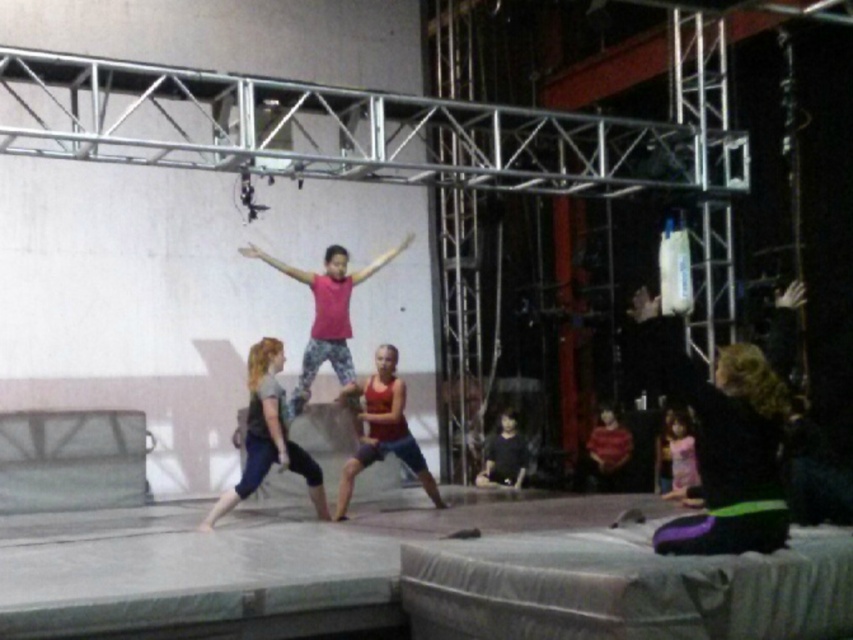
You are organizing a fashion show and need to display two dresses in the gymnasium. The black fabric dress at lower right and the pink fabric dress at lower right are both placed at the lower right corner. Which dress will be more visible to the audience seated in front of the gymnasium?

The black fabric dress at lower right is positioned over the pink fabric dress at lower right, so the black fabric dress at lower right will be more visible to the audience since it is in front.

You are a photographer setting up for a photoshoot in this gym. You have two outfits to choose from for the model. The first is the red fabric tank top at center and the second is the pink fabric dress at lower right. Based on their sizes, which outfit would be more suitable for a full body shot to ensure the entire outfit is visible in the frame?

The red fabric tank top at center is larger in size than the pink fabric dress at lower right, so the red fabric tank top at center would be more suitable for a full body shot since its larger size ensures better visibility in the frame.

You are organizing a clothing display and need to arrange the red fabric tank top at center and the pink fabric dress at lower right on a shelf. Which item should you place first to ensure they both fit on the shelf?

The red fabric tank top at center has a larger width than the pink fabric dress at lower right, so you should place the red fabric tank top at center first to accommodate its wider size before placing the pink fabric dress at lower right.